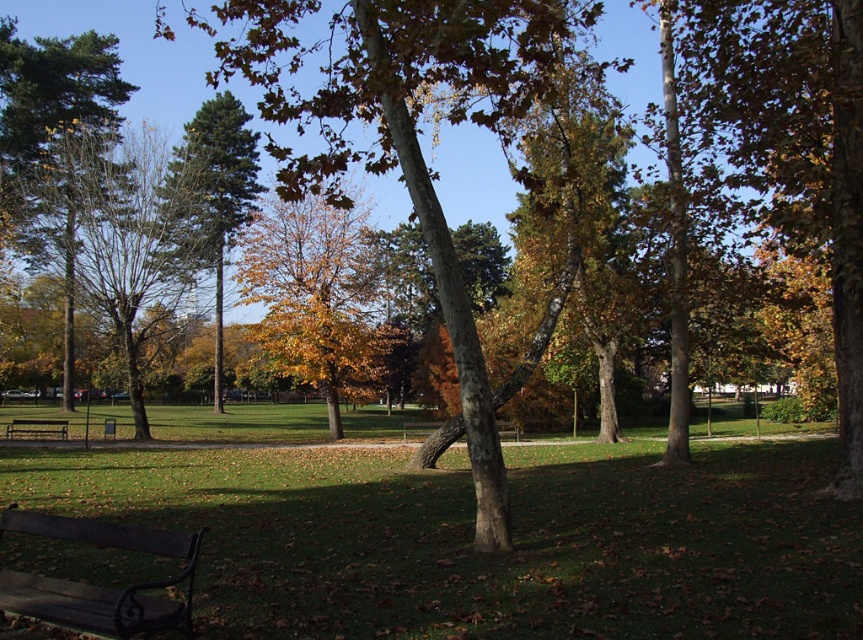
Who is more forward, [369,280] or [0,572]?

Point [0,572]

Which is behind, point (287, 307) or point (129, 540)?

Point (287, 307)

Does point (338, 369) lie in front of point (79, 595)?

No, it is behind (79, 595).

Identify the location of yellow-green leaves at center. The image size is (863, 640). (313, 296).

Can you confirm if wooden bench at lower left is positioned to the left of wooden bench at center?

Indeed, wooden bench at lower left is positioned on the left side of wooden bench at center.

Between wooden bench at lower left and wooden bench at center, which one appears on the left side from the viewer's perspective?

Positioned to the left is wooden bench at lower left.

Is point (38, 419) less distant than point (515, 429)?

No, (38, 419) is behind (515, 429).

The height and width of the screenshot is (640, 863). I want to click on wooden bench at lower left, so click(x=36, y=426).

Locate an element on the screen. brown rough bark tree at center is located at coordinates (404, 132).

Which of these two, brown rough bark tree at center or green glossy tree at center, stands shorter?

green glossy tree at center

This screenshot has width=863, height=640. Identify the location of brown rough bark tree at center. (404, 132).